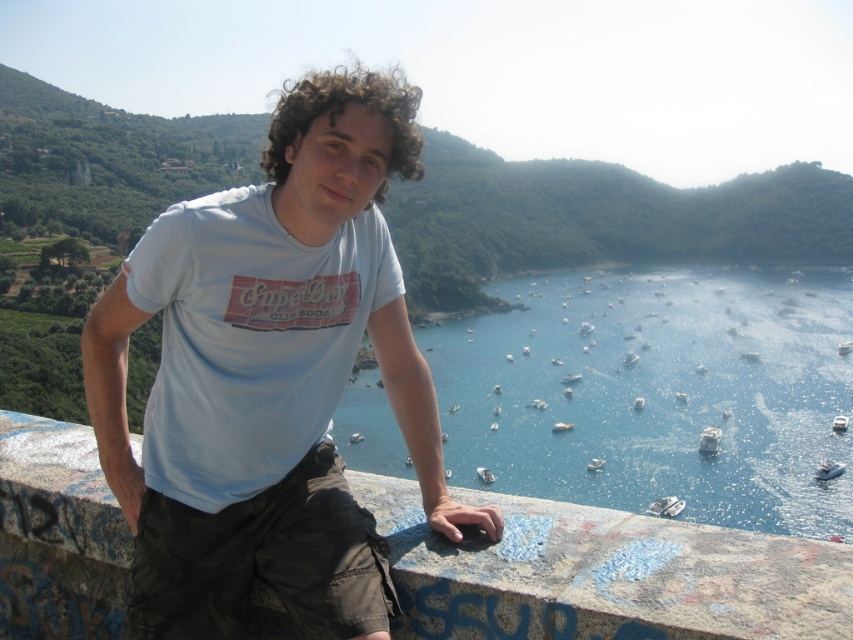
Locate an element on the screen. This screenshot has width=853, height=640. blue water at center is located at coordinates (657, 392).

Can you confirm if blue water at center is taller than white plastic boat at center?

Yes.

Identify the location of blue water at center. click(657, 392).

Between granite ledge at center and white plastic boat at center, which one is positioned higher?

granite ledge at center is higher up.

Does granite ledge at center have a greater width compared to white plastic boat at center?

Indeed, granite ledge at center has a greater width compared to white plastic boat at center.

Measure the distance between point (x=62, y=520) and camera.

Point (x=62, y=520) is 5.97 meters away from camera.

This screenshot has width=853, height=640. Find the location of `granite ledge at center`. granite ledge at center is located at coordinates (x=602, y=573).

Which is behind, point (181, 380) or point (650, 508)?

Point (650, 508)

Identify the location of light blue cotton t-shirt at center. Image resolution: width=853 pixels, height=640 pixels. coord(248,339).

Between point (202, 504) and point (664, 500), which one is positioned behind?

Positioned behind is point (664, 500).

Locate an element on the screen. This screenshot has height=640, width=853. light blue cotton t-shirt at center is located at coordinates (248, 339).